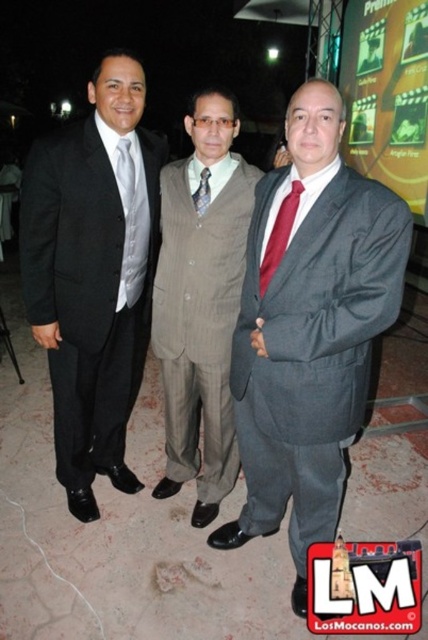
Between matte gray suit at center and matte white tie at center, which one is positioned higher?

matte white tie at center is higher up.

Between matte gray suit at center and matte white tie at center, which one has more height?

matte gray suit at center is taller.

Is point (296, 412) in front of point (121, 177)?

Yes, it is in front of point (121, 177).

Locate an element on the screen. Image resolution: width=428 pixels, height=640 pixels. matte gray suit at center is located at coordinates (309, 326).

Can you confirm if gray pinstripe suit at center is thinner than matte white tie at center?

No.

Can you confirm if gray pinstripe suit at center is positioned to the right of matte white tie at center?

Correct, you'll find gray pinstripe suit at center to the right of matte white tie at center.

The height and width of the screenshot is (640, 428). What are the coordinates of `gray pinstripe suit at center` in the screenshot? It's located at (201, 301).

Is gray pinstripe suit at center to the left of patterned silk tie at center from the viewer's perspective?

Indeed, gray pinstripe suit at center is positioned on the left side of patterned silk tie at center.

Who is more distant from viewer, (x=211, y=132) or (x=207, y=204)?

Point (x=207, y=204)

Who is more forward, (x=175, y=444) or (x=208, y=202)?

Positioned in front is point (x=208, y=202).

Identify the location of gray pinstripe suit at center. (201, 301).